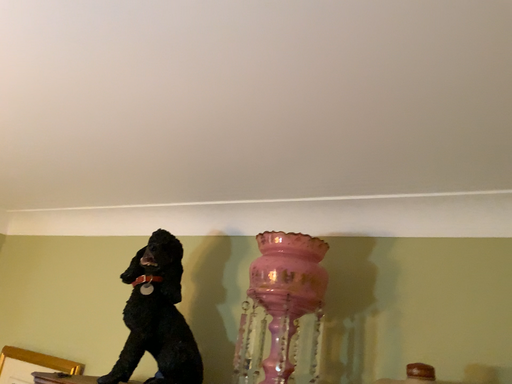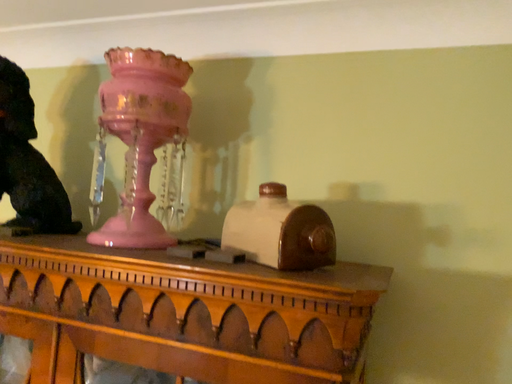
Question: How did the camera likely rotate when shooting the video?

Choices:
 (A) rotated upward
 (B) rotated downward

Answer: (B)